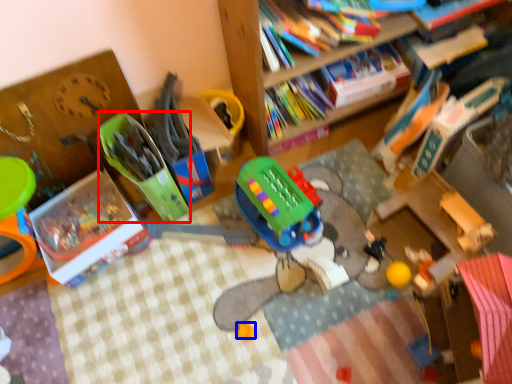
Question: Which object appears farthest to the camera in this image, toy (highlighted by a red box) or toy (highlighted by a blue box)?

Choices:
 (A) toy
 (B) toy

Answer: (B)